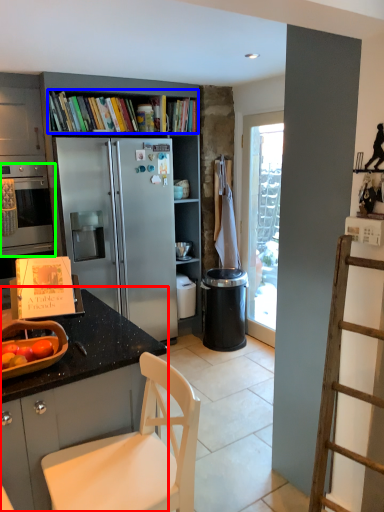
Question: Estimate the real-world distances between objects in this image. Which object is farther from countertop (highlighted by a red box), book (highlighted by a blue box) or oven (highlighted by a green box)?

Choices:
 (A) book
 (B) oven

Answer: (A)